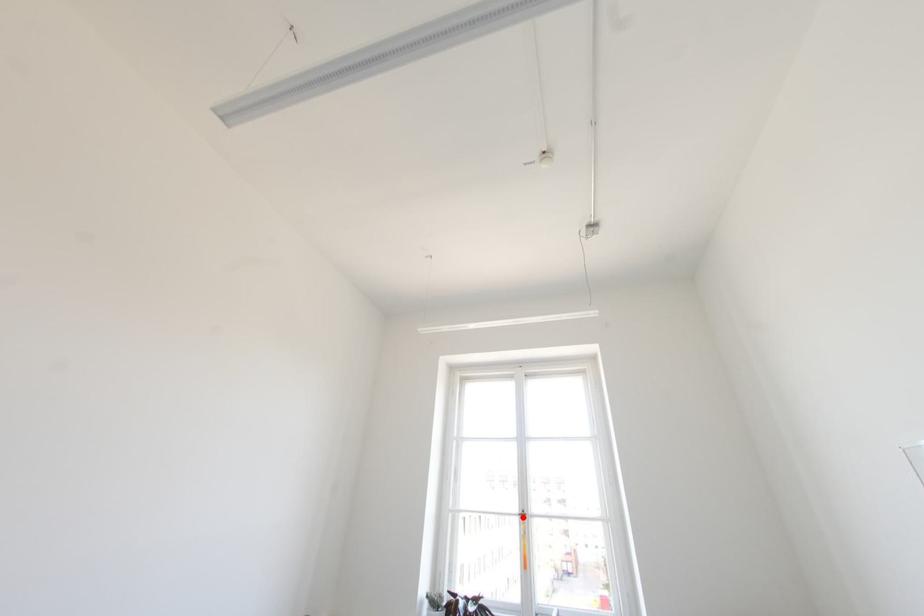
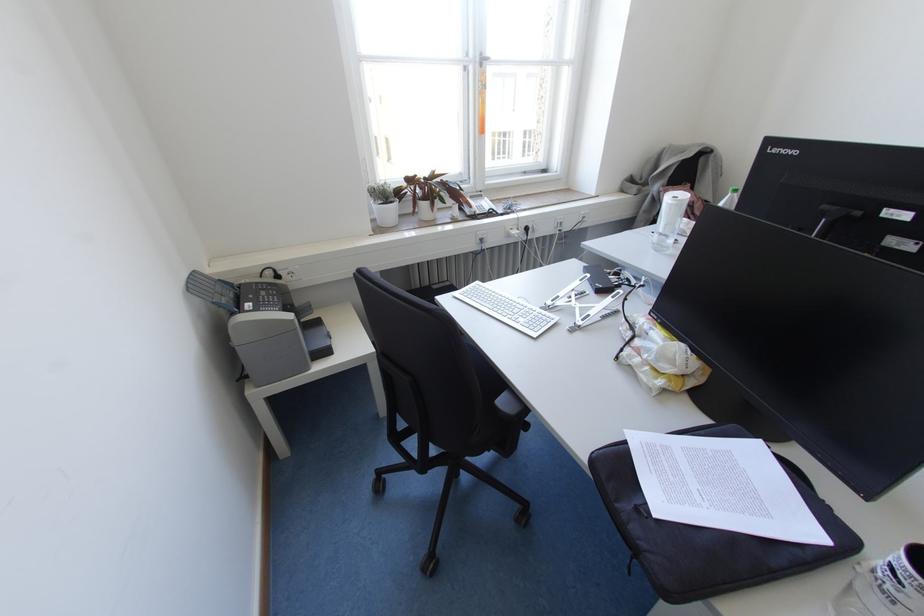
Question: I am providing you with two images of the same scene from different viewpoints. A red point is shown in image1. For the corresponding object point in image2, is it positioned nearer or farther from the camera?

Choices:
 (A) Nearer
 (B) Farther

Answer: (A)